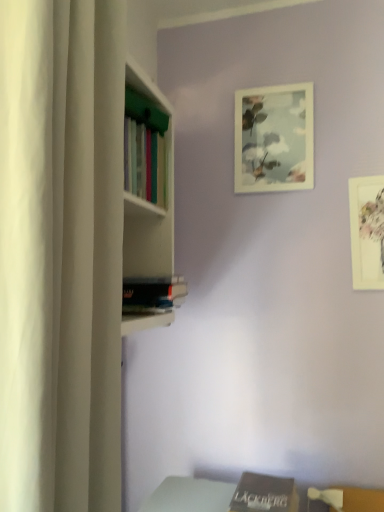
Question: Should I look upward or downward to see brown matte book at lower center, positioned as the second book in left-to-right order?

Choices:
 (A) down
 (B) up

Answer: (A)

Question: Does brown matte book at lower center, which is the second book from top to bottom, have a larger size compared to hardcover book at center, the second book positioned from the right?

Choices:
 (A) no
 (B) yes

Answer: (A)

Question: Is the surface of brown matte book at lower center, positioned as the second book in left-to-right order, in direct contact with hardcover book at center, the first book from the top?

Choices:
 (A) yes
 (B) no

Answer: (B)

Question: Considering the relative positions of brown matte book at lower center, the first book when ordered from bottom to top, and hardcover book at center, the 2th book from the bottom, in the image provided, is brown matte book at lower center, the first book when ordered from bottom to top, to the right of hardcover book at center, the 2th book from the bottom, from the viewer's perspective?

Choices:
 (A) no
 (B) yes

Answer: (B)

Question: Is the position of brown matte book at lower center, which is the second book from top to bottom, more distant than that of hardcover book at center, the 2th book from the bottom?

Choices:
 (A) yes
 (B) no

Answer: (B)

Question: From a real-world perspective, is brown matte book at lower center, which is the second book from top to bottom, under hardcover book at center, the 2th book from the bottom?

Choices:
 (A) yes
 (B) no

Answer: (A)

Question: From the image's perspective, would you say brown matte book at lower center, the first book when ordered from bottom to top, is positioned over hardcover book at center, the 1th book from the left?

Choices:
 (A) no
 (B) yes

Answer: (A)

Question: Is white matte picture frame at upper right, marked as the second picture frame in a left-to-right arrangement, beside white matte curtain at left?

Choices:
 (A) no
 (B) yes

Answer: (A)

Question: Does white matte picture frame at upper right, the 1th picture frame ordered from the bottom, have a lesser height compared to white matte curtain at left?

Choices:
 (A) yes
 (B) no

Answer: (A)

Question: Would you consider white matte picture frame at upper right, which is counted as the second picture frame, starting from the back, to be distant from white matte curtain at left?

Choices:
 (A) yes
 (B) no

Answer: (B)

Question: Can you confirm if white matte picture frame at upper right, the 1th picture frame in the front-to-back sequence, is bigger than white matte curtain at left?

Choices:
 (A) no
 (B) yes

Answer: (A)

Question: Is white matte picture frame at upper right, the 1th picture frame in the front-to-back sequence, oriented away from white matte curtain at left?

Choices:
 (A) yes
 (B) no

Answer: (B)

Question: From a real-world perspective, is white matte picture frame at upper right, the 2th picture frame when ordered from top to bottom, physically below white matte curtain at left?

Choices:
 (A) no
 (B) yes

Answer: (A)

Question: Considering the relative sizes of white matte curtain at left and matte white picture frame at upper center, which is the 1th picture frame from back to front, in the image provided, is white matte curtain at left thinner than matte white picture frame at upper center, which is the 1th picture frame from back to front,?

Choices:
 (A) yes
 (B) no

Answer: (B)